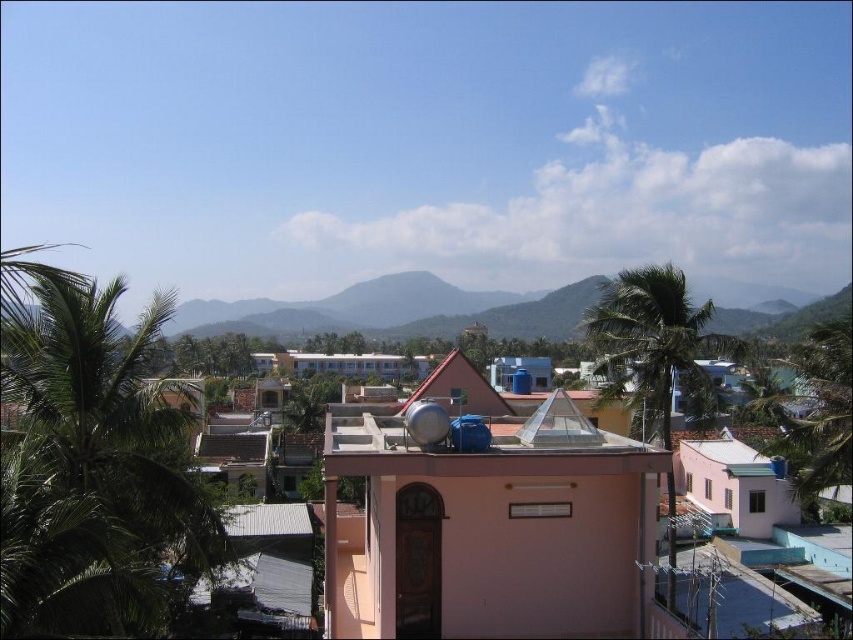
You are standing at the point marked by the coordinates point (x=88, y=464) in the image, which is at the base of a green leafy palm tree at left. You want to walk directly towards the building with a light pink facade and a reddish brown triangular roof in the center. Will you have to walk through any other structures or obstacles along the way?

The point marked by the coordinates point (x=88, y=464) is at the base of a green leafy palm tree at left. The building with a light pink facade and a reddish brown triangular roof is in the center. Since the palm tree is at the left and the building is in the center, there are no structures or obstacles between them mentioned in the scene description, so you can walk directly towards the building without obstruction.

You are standing at the center of the village and notice two points marked in the image. The first point is at coordinates point (132, 499) and the second is at point (630, 289). Which point is closer to you?

Point (132, 499) is in front of point (630, 289), so the first point is closer to you.